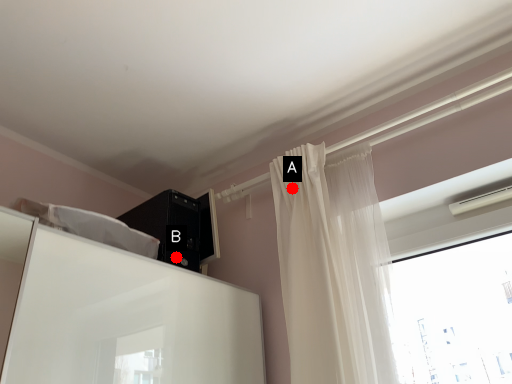
Question: Two points are circled on the image, labeled by A and B beside each circle. Among these points, which one is farthest from the camera?

Choices:
 (A) A is further
 (B) B is further

Answer: (B)